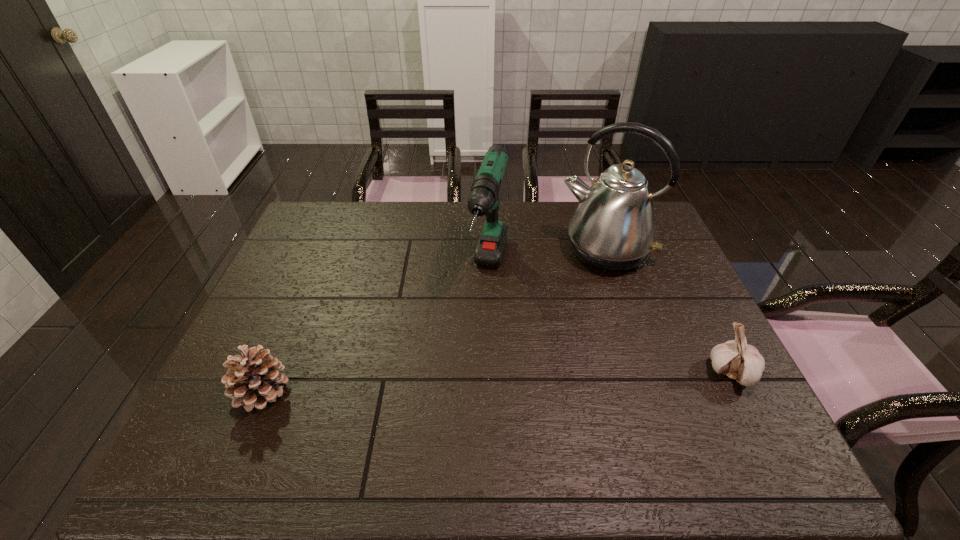
At what (x,y) coordinates should I click in order to perform the action: click on pinecone. Please return your answer as a coordinate pair (x, y). Looking at the image, I should click on (253, 380).

I want to click on garlic, so click(x=736, y=359).

The height and width of the screenshot is (540, 960). In order to click on the second tallest object in this screenshot , I will do `click(483, 199)`.

You are a GUI agent. You are given a task and a screenshot of the screen. Output one action in this format:
    pyautogui.click(x=<x>, y=<y>)
    Task: Click on the drill
    The height and width of the screenshot is (540, 960).
    Given the screenshot: What is the action you would take?
    pyautogui.click(x=483, y=199)

Where is `kettle`? This screenshot has width=960, height=540. kettle is located at coordinates (613, 229).

The width and height of the screenshot is (960, 540). I want to click on vacant space located 0.080m on the back of the pinecone, so click(x=282, y=342).

The height and width of the screenshot is (540, 960). Identify the location of vacant area located on the left of the garlic. (581, 373).

This screenshot has width=960, height=540. What are the coordinates of `vacant area located on the handle side of the drill` in the screenshot? It's located at (479, 348).

Locate an element on the screen. The width and height of the screenshot is (960, 540). vacant region located on the handle side of the drill is located at coordinates (479, 348).

I want to click on vacant region located on the handle side of the drill, so click(x=471, y=377).